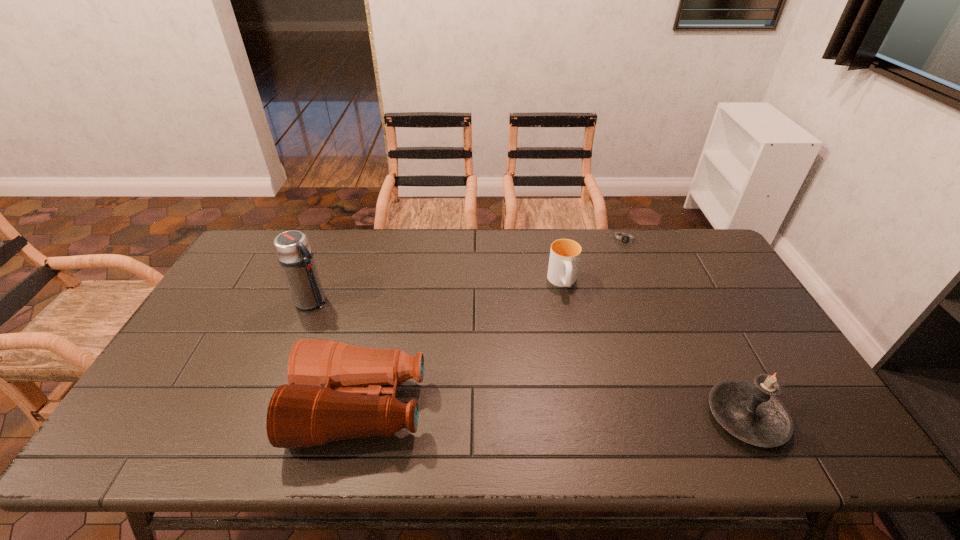
This screenshot has height=540, width=960. I want to click on binoculars, so click(324, 401).

Identify the location of the third shortest object. (324, 401).

Locate an element on the screen. The height and width of the screenshot is (540, 960). the second tallest object is located at coordinates (751, 412).

Locate an element on the screen. the third object from right to left is located at coordinates (564, 259).

Find the location of a particular element. This screenshot has height=540, width=960. cup is located at coordinates (564, 259).

Where is `the farthest object`? Image resolution: width=960 pixels, height=540 pixels. the farthest object is located at coordinates (625, 239).

This screenshot has height=540, width=960. Find the location of `the shortest object`. the shortest object is located at coordinates (625, 239).

The height and width of the screenshot is (540, 960). I want to click on the tallest object, so click(292, 248).

Identify the location of thermos bottle. The width and height of the screenshot is (960, 540). (292, 248).

You are a GUI agent. You are given a task and a screenshot of the screen. Output one action in this format:
    pyautogui.click(x=<x>, y=<y>)
    Task: Click on the vacant position located through the lenses of the second object from left to right
    The image size is (960, 540).
    Given the screenshot: What is the action you would take?
    pyautogui.click(x=228, y=408)